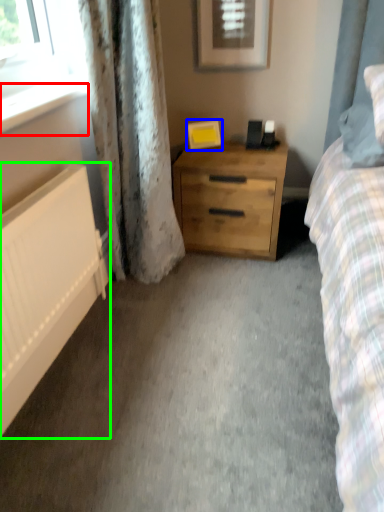
Question: Based on their relative distances, which object is farther from window sill (highlighted by a red box)? Choose from picture frame (highlighted by a blue box) and radiator (highlighted by a green box).

Choices:
 (A) picture frame
 (B) radiator

Answer: (A)